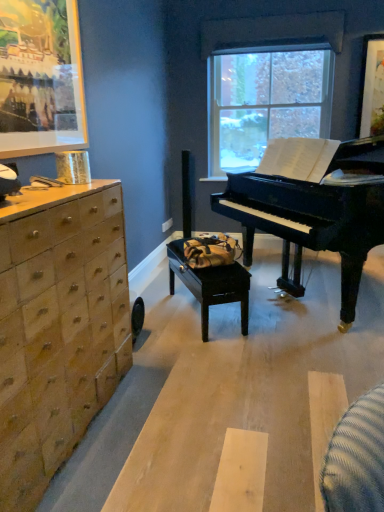
Question: Is clear glass window at center looking in the opposite direction of wooden chest of drawers at left?

Choices:
 (A) no
 (B) yes

Answer: (A)

Question: Is clear glass window at center far away from wooden chest of drawers at left?

Choices:
 (A) no
 (B) yes

Answer: (B)

Question: Is clear glass window at center outside of wooden chest of drawers at left?

Choices:
 (A) yes
 (B) no

Answer: (A)

Question: Is clear glass window at center at the right side of wooden chest of drawers at left?

Choices:
 (A) no
 (B) yes

Answer: (B)

Question: Is clear glass window at center oriented towards wooden chest of drawers at left?

Choices:
 (A) no
 (B) yes

Answer: (B)

Question: Is clear glass window at center wider than wooden chest of drawers at left?

Choices:
 (A) no
 (B) yes

Answer: (A)

Question: Can you confirm if wooden chest of drawers at left is shorter than clear glass window at center?

Choices:
 (A) no
 (B) yes

Answer: (B)

Question: Can you confirm if wooden chest of drawers at left is smaller than clear glass window at center?

Choices:
 (A) no
 (B) yes

Answer: (A)

Question: Can we say wooden chest of drawers at left lies outside clear glass window at center?

Choices:
 (A) no
 (B) yes

Answer: (B)

Question: Is wooden chest of drawers at left in contact with clear glass window at center?

Choices:
 (A) no
 (B) yes

Answer: (A)

Question: From the image's perspective, is wooden chest of drawers at left above clear glass window at center?

Choices:
 (A) yes
 (B) no

Answer: (B)

Question: Can you confirm if wooden chest of drawers at left is thinner than clear glass window at center?

Choices:
 (A) no
 (B) yes

Answer: (A)

Question: From the image's perspective, would you say wooden chest of drawers at left is shown under black wood table at center?

Choices:
 (A) no
 (B) yes

Answer: (B)